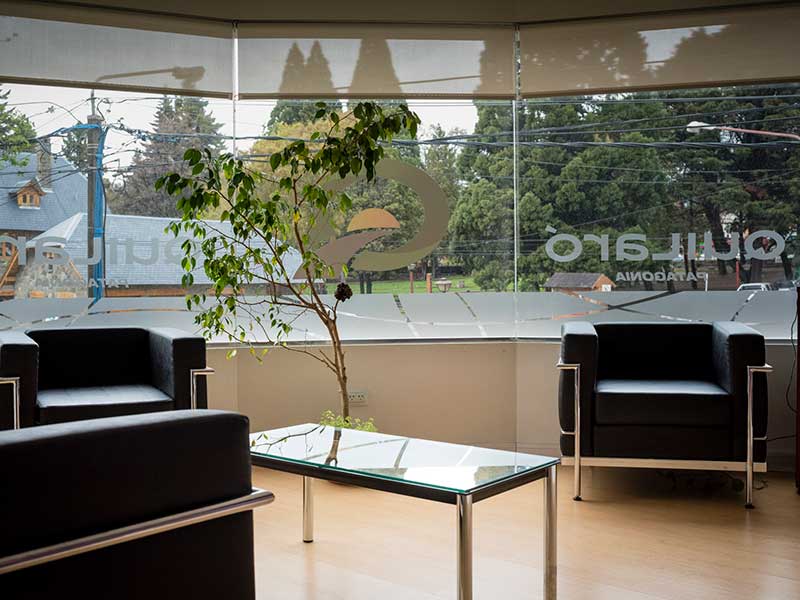
Find the location of `chimney`. chimney is located at coordinates (41, 157).